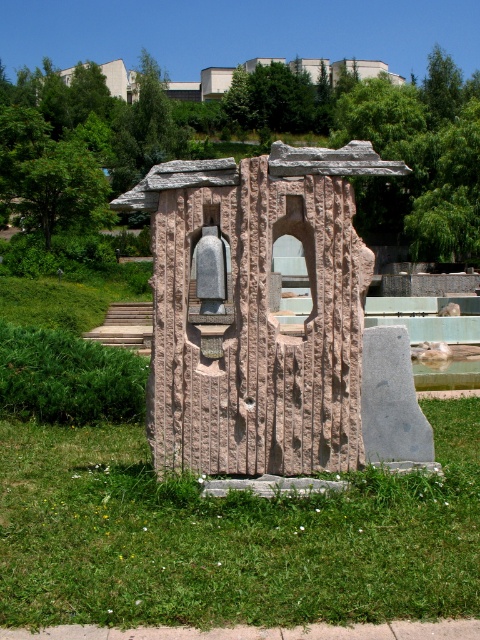
Who is positioned more to the left, green grass at center or rough stone sculpture at center?

rough stone sculpture at center

Between green grass at center and rough stone sculpture at center, which one appears on the right side from the viewer's perspective?

Positioned to the right is green grass at center.

Between point (4, 611) and point (223, 403), which one is positioned behind?

The point (223, 403) is more distant.

Locate an element on the screen. The width and height of the screenshot is (480, 640). green grass at center is located at coordinates (229, 536).